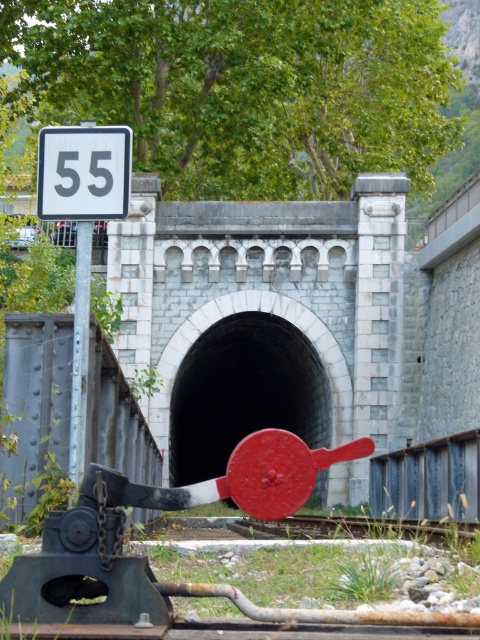
You are a railway worker inspecting the tunnel entrance. You see the metal train track at center and the metallic pole at left. Which object is positioned lower in the scene?

The metal train track at center is positioned lower than the metallic pole at left because it is described as being below it.

You are a railway inspector checking the tunnel entrance. You notice the metal train track at center and the metallic pole at left. Which object is wider?

The metal train track at center is wider than the metallic pole at left.

You are a maintenance worker standing at point A, which is at coordinates point (120, 140). You need to reach point B at coordinates point (272, 524) to inspect a lever mechanism. According to the scene description, which direction should you move relative to the tunnel entrance?

Since point (120, 140) is in front of point (272, 524), you should move towards the tunnel entrance to reach point B from point A.